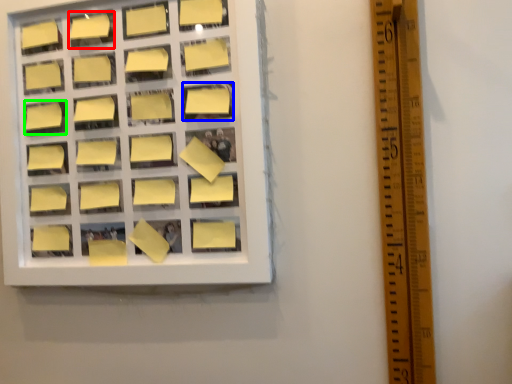
Question: Which object is positioned closest to square (highlighted by a red box)? Select from square (highlighted by a blue box) and square (highlighted by a green box).

Choices:
 (A) square
 (B) square

Answer: (B)